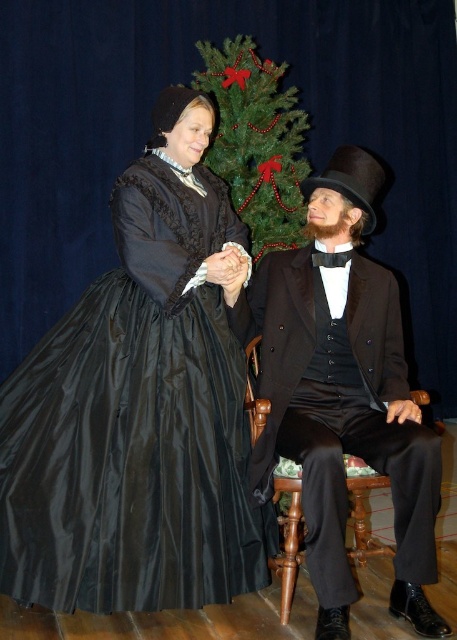
This screenshot has width=457, height=640. I want to click on matte black dress at center, so click(x=139, y=406).

Can you confirm if matte black dress at center is positioned to the right of green textured christmas tree at center?

In fact, matte black dress at center is to the left of green textured christmas tree at center.

Is point (235, 410) positioned behind point (275, 221)?

No, (235, 410) is in front of (275, 221).

The width and height of the screenshot is (457, 640). I want to click on matte black dress at center, so click(x=139, y=406).

Does matte black dress at center appear over matte black suit at center?

Yes.

From the picture: Is matte black dress at center positioned behind matte black suit at center?

Yes, it is behind matte black suit at center.

Locate an element on the screen. The width and height of the screenshot is (457, 640). matte black dress at center is located at coordinates (139, 406).

Find the location of `matte black dress at center`. matte black dress at center is located at coordinates (139, 406).

Can you confirm if matte black suit at center is wider than green textured christmas tree at center?

Yes, matte black suit at center is wider than green textured christmas tree at center.

The height and width of the screenshot is (640, 457). Describe the element at coordinates (343, 394) in the screenshot. I see `matte black suit at center` at that location.

Does point (341, 388) lie in front of point (286, 161)?

Yes, point (341, 388) is in front of point (286, 161).

I want to click on matte black suit at center, so click(343, 394).